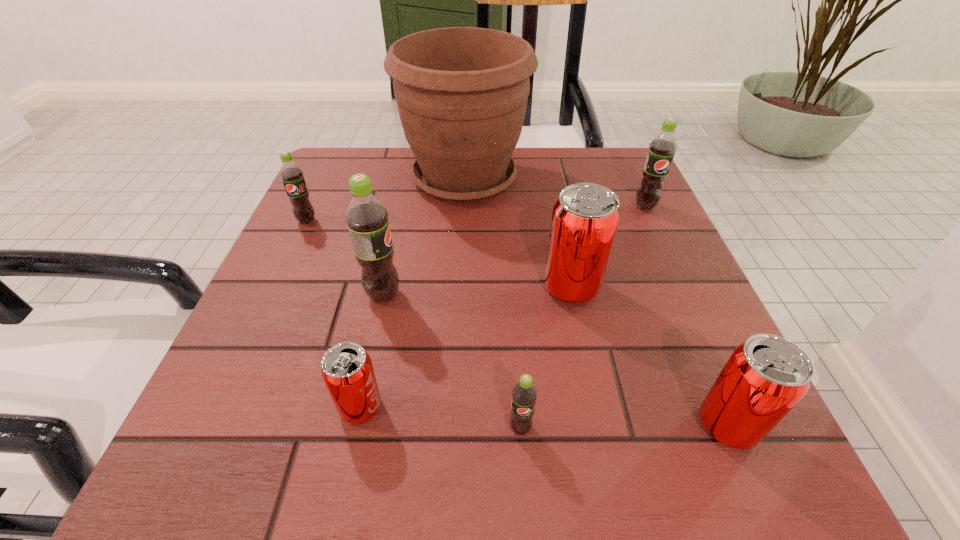
Where is `the leftmost red soda can`? This screenshot has width=960, height=540. the leftmost red soda can is located at coordinates (x=347, y=370).

Find the location of a particular element. This screenshot has width=960, height=540. the second green soda from right to left is located at coordinates (524, 394).

What are the coordinates of `the smallest green soda` in the screenshot? It's located at (524, 394).

Find the location of `vacant space situated 0.080m on the right of the flowerpot`. vacant space situated 0.080m on the right of the flowerpot is located at coordinates (562, 179).

This screenshot has width=960, height=540. Identify the location of vacant position located on the front label of the tallest soda. (610, 295).

Where is `blank space located on the back of the farthest red soda can`? The height and width of the screenshot is (540, 960). blank space located on the back of the farthest red soda can is located at coordinates (556, 214).

I want to click on vacant region located 0.290m on the front label of the farthest soda, so click(697, 318).

You are a GUI agent. You are given a task and a screenshot of the screen. Output one action in this format:
    pyautogui.click(x=<x>, y=<y>)
    Task: Click on the vacant space situated 0.300m on the front label of the sixth nearest soda
    The height and width of the screenshot is (540, 960).
    Given the screenshot: What is the action you would take?
    pos(249,345)

Identify the location of vacant area situated on the back of the second biggest red soda can. (645, 234).

Identify the location of free space located 0.110m on the right of the leftmost red soda can. (462, 407).